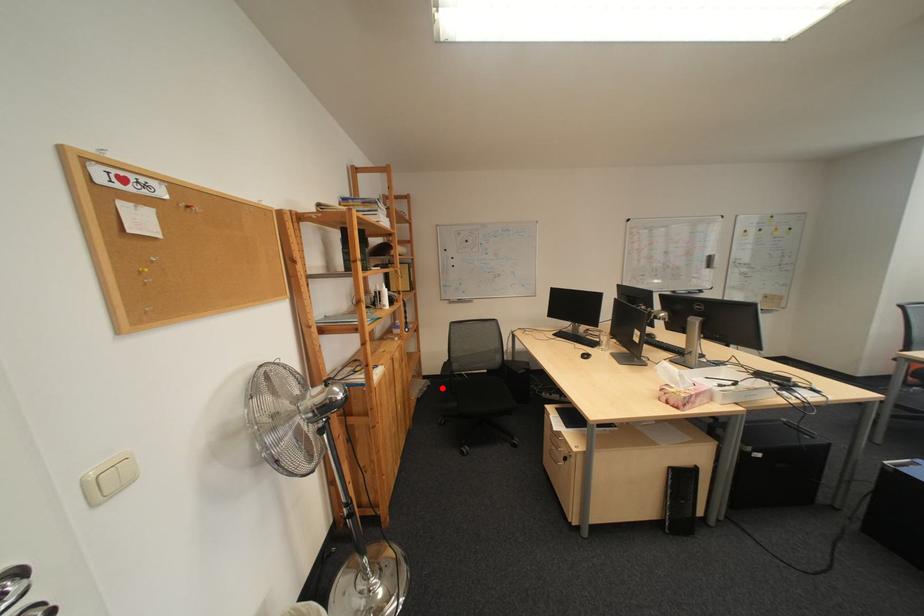
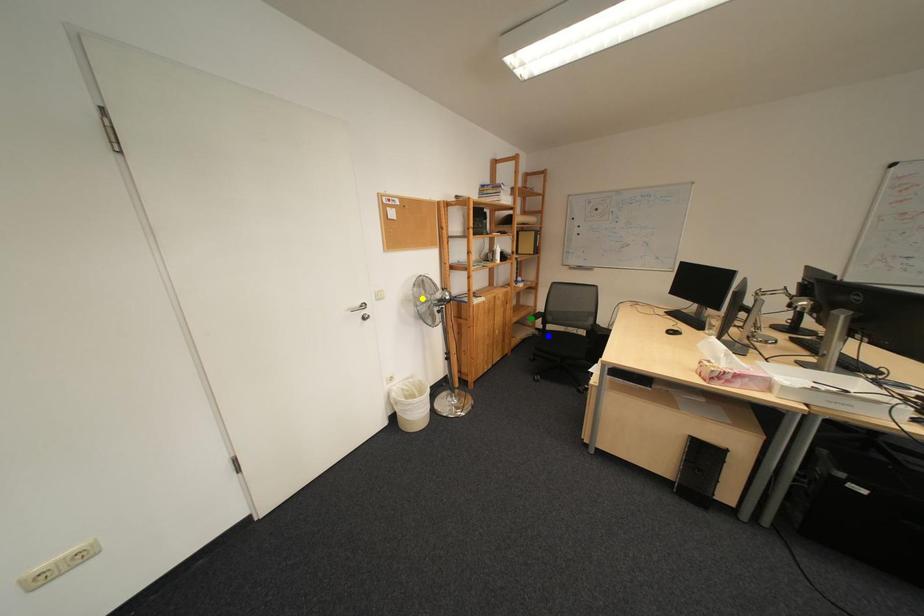
Question: I am providing you with two images of the same scene from different viewpoints. A red point is marked on the first image. You are given multiple points on the second image. Can you choose the point in image 2 that corresponds to the point in image 1?

Choices:
 (A) green point
 (B) yellow point
 (C) blue point

Answer: (C)